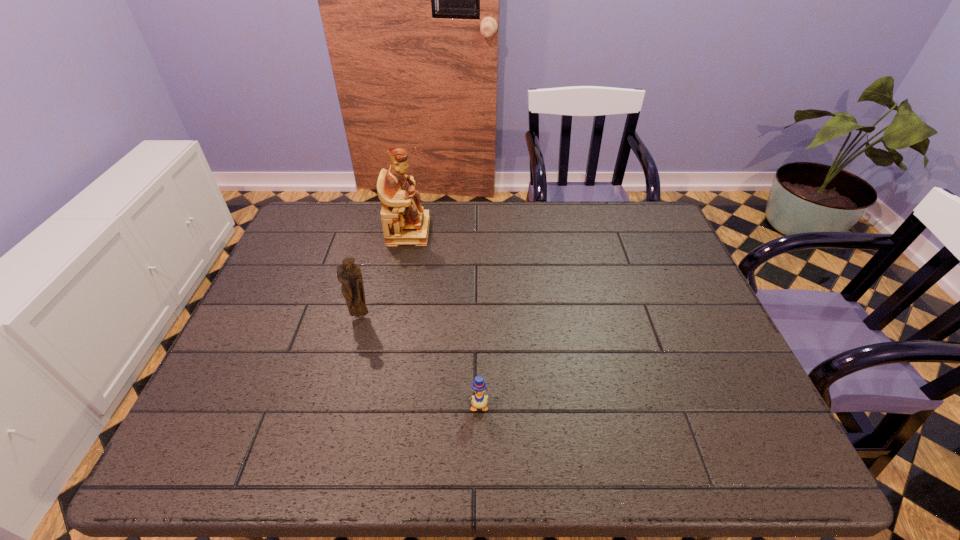
Find the location of a particular element. the taller figurine is located at coordinates point(404,222).

You are a GUI agent. You are given a task and a screenshot of the screen. Output one action in this format:
    pyautogui.click(x=<x>, y=<y>)
    Task: Click on the farthest object
    This screenshot has width=960, height=540.
    Given the screenshot: What is the action you would take?
    pyautogui.click(x=404, y=222)

This screenshot has width=960, height=540. Identify the location of the second farthest object. (349, 274).

Image resolution: width=960 pixels, height=540 pixels. I want to click on the shorter figurine, so click(349, 274).

Locate an element on the screen. Image resolution: width=960 pixels, height=540 pixels. the nearest object is located at coordinates (479, 400).

This screenshot has width=960, height=540. Find the location of `the shortest object`. the shortest object is located at coordinates (479, 400).

At what (x,y) coordinates should I click in order to perform the action: click on vacant space located on the front-facing side of the farther figurine. Please return your answer as a coordinate pair (x, y). Looking at the image, I should click on (483, 231).

The image size is (960, 540). Identify the location of vacant area located 0.260m on the front-facing side of the second nearest object. (335, 415).

Find the location of a particular element. This screenshot has height=540, width=960. vacant space located 0.070m on the face of the nearest object, where the monocle is placed is located at coordinates (478, 446).

Identify the location of object that is at the far edge. (404, 222).